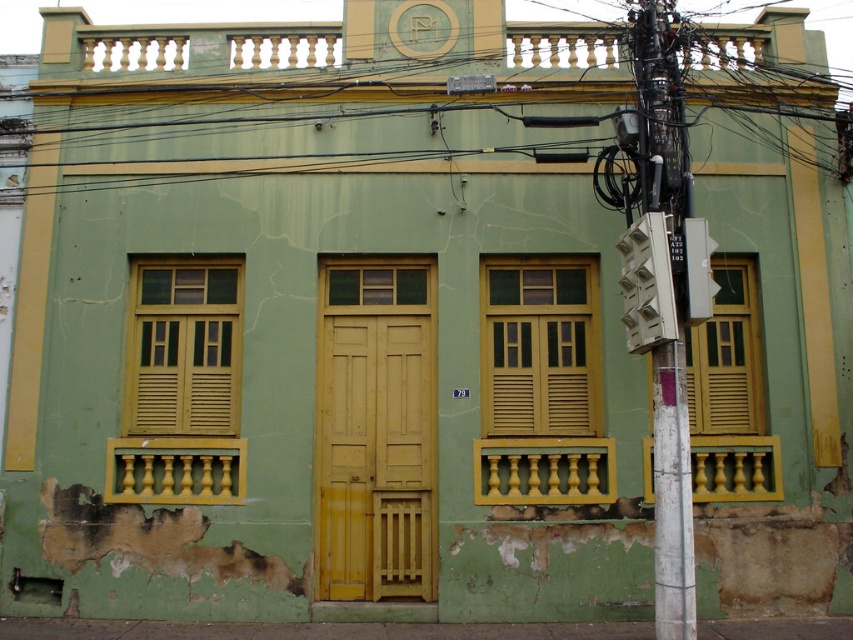
Question: Is black wire at upper center smaller than yellow matte shutter at right?

Choices:
 (A) no
 (B) yes

Answer: (A)

Question: Is the position of wooden slatted shutters at left more distant than that of yellow matte shutter at right?

Choices:
 (A) yes
 (B) no

Answer: (A)

Question: Which point appears farthest from the camera in this image?

Choices:
 (A) click(x=485, y=390)
 (B) click(x=624, y=234)

Answer: (B)

Question: Which object is farther from the camera taking this photo?

Choices:
 (A) yellow matte door at center
 (B) yellow matte shutter at right

Answer: (B)

Question: Which is nearer to the yellow matte door at center?

Choices:
 (A) white plastic traffic light at right
 (B) wooden slatted shutters at left
 (C) wooden at center
 (D) metallic gray traffic light at right

Answer: (C)

Question: Is yellow matte door at center behind metallic gray traffic light at right?

Choices:
 (A) no
 (B) yes

Answer: (B)